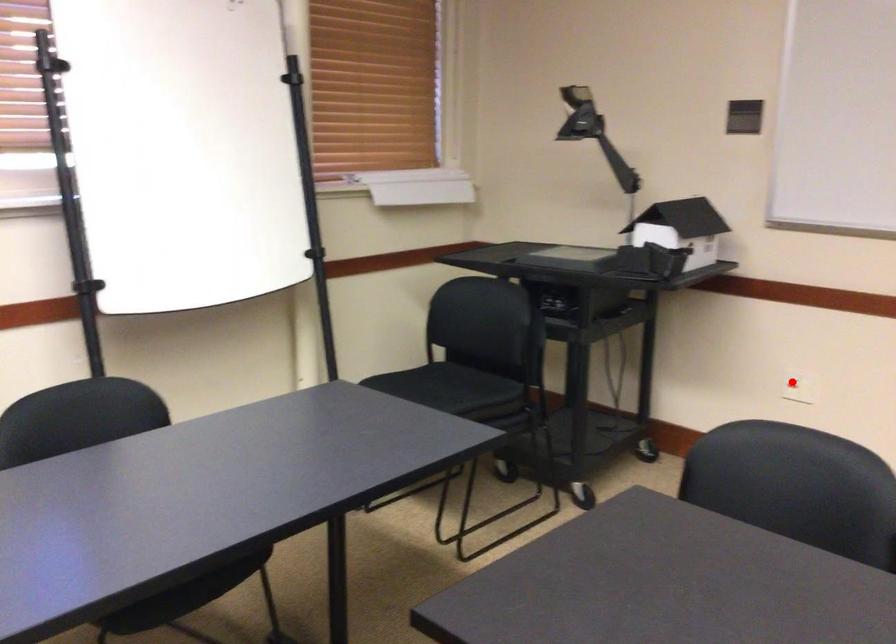
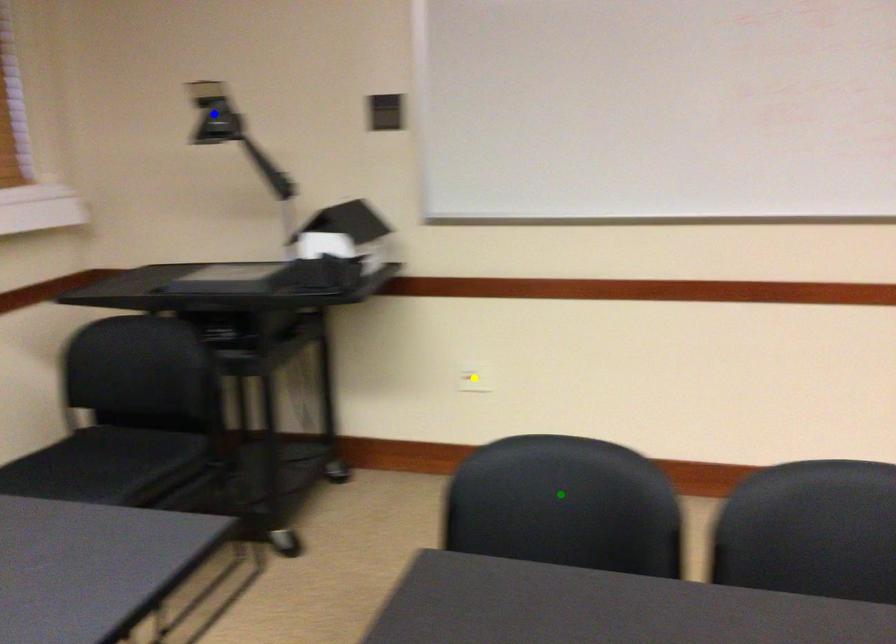
Question: I am providing you with two images of the same scene from different viewpoints. A red point is marked on the first image. You are given multiple points on the second image. Which spot in image 2 lines up with the point in image 1?

Choices:
 (A) green point
 (B) blue point
 (C) yellow point

Answer: (C)